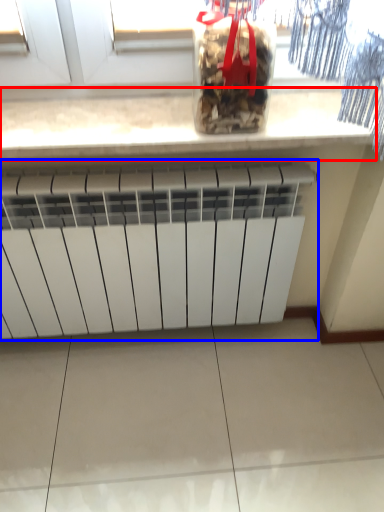
Question: Which of the following is the closest to the observer, countertop (highlighted by a red box) or radiator (highlighted by a blue box)?

Choices:
 (A) countertop
 (B) radiator

Answer: (A)